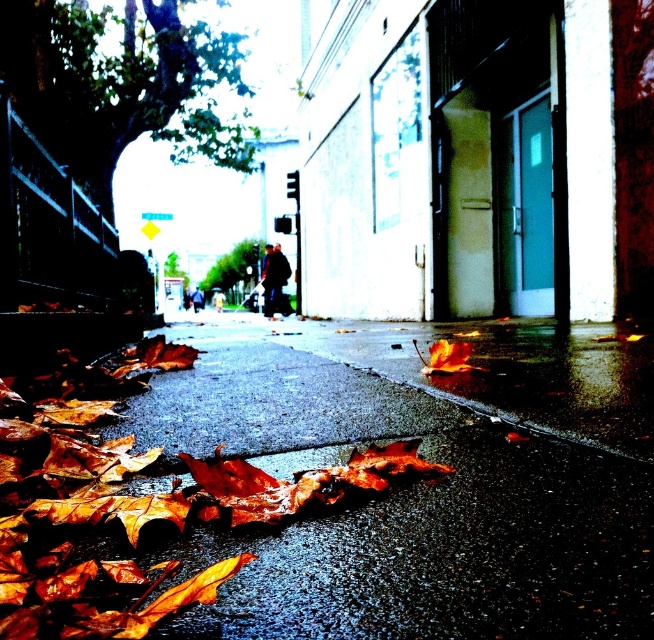
You are a photographer trying to capture the entire scene in one shot. Given that the brown papery leaves at lower left and the green leafy tree at center are both in your frame, which object should you focus on to ensure the other remains in the background?

You should focus on the green leafy tree at center because it occupies more space in the frame than the brown papery leaves at lower left, making the latter naturally recede into the background.